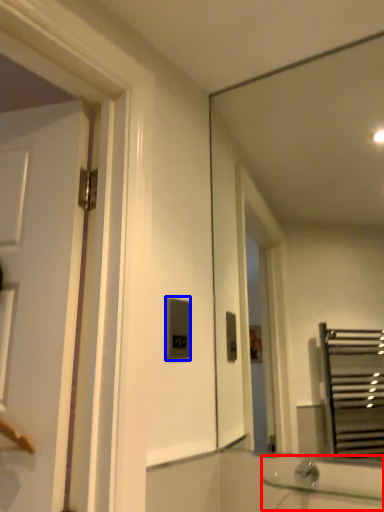
Question: Which object is further to the camera taking this photo, sink (highlighted by a red box) or light switch (highlighted by a blue box)?

Choices:
 (A) sink
 (B) light switch

Answer: (B)